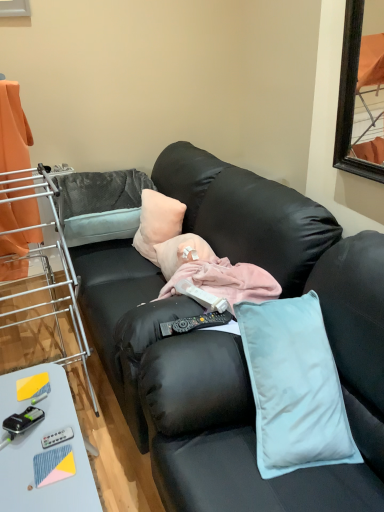
Locate an element on the screen. Image resolution: width=384 pixels, height=512 pixels. free space in front of metallic silver remote control at lower left, the second equipment when ordered from left to right is located at coordinates (45, 478).